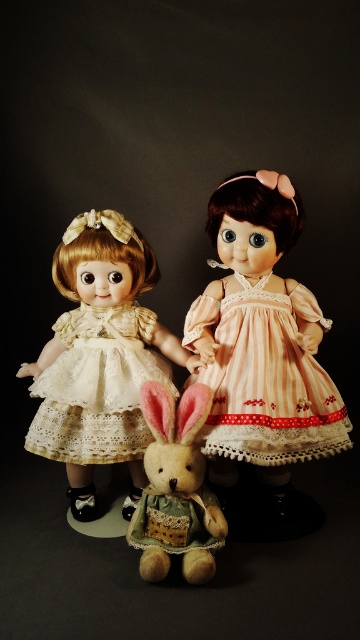
From the picture: Can you confirm if matte cream lace dress at center is shorter than white lace dress at left?

In fact, matte cream lace dress at center may be taller than white lace dress at left.

Is point (102, 307) in front of point (51, 397)?

No, (102, 307) is behind (51, 397).

Where is `matte cream lace dress at center`? This screenshot has width=360, height=640. matte cream lace dress at center is located at coordinates (100, 356).

Is white lace dress at left wider than fluffy brown plush at center?

Indeed, white lace dress at left has a greater width compared to fluffy brown plush at center.

Can you confirm if white lace dress at left is bigger than fluffy brown plush at center?

Yes, white lace dress at left is bigger than fluffy brown plush at center.

Is point (138, 380) positioned behind point (183, 465)?

That is True.

Identify the location of white lace dress at left. This screenshot has width=360, height=640. (97, 387).

Locate an element on the screen. This screenshot has height=640, width=360. pink striped fabric dress at center is located at coordinates (266, 378).

Can you confirm if pink striped fabric dress at center is taller than fluffy brown plush at center?

Yes, pink striped fabric dress at center is taller than fluffy brown plush at center.

Where is `pink striped fabric dress at center`? The image size is (360, 640). pink striped fabric dress at center is located at coordinates (266, 378).